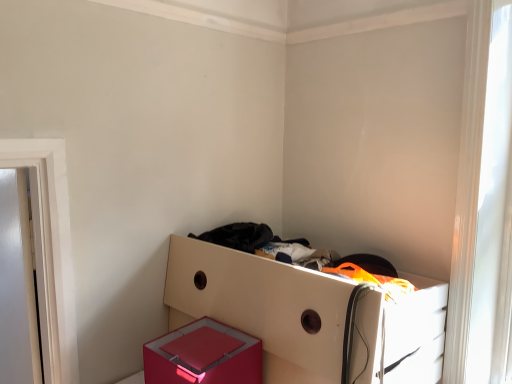
This screenshot has width=512, height=384. Describe the element at coordinates (262, 306) in the screenshot. I see `white glossy drawer at center` at that location.

The width and height of the screenshot is (512, 384). Describe the element at coordinates (203, 355) in the screenshot. I see `shiny pink box at lower center` at that location.

At what (x,y) coordinates should I click in order to perform the action: click on white glossy drawer at center. Please return your answer as a coordinate pair (x, y). Looking at the image, I should click on tap(262, 306).

Identify the location of furniture below the transparent glass window at upper right (from a real-world perspective). (262, 306).

Between transparent glass window at upper right and white glossy drawer at center, which one has more height?

transparent glass window at upper right.

Is transparent glass window at upper right not inside white glossy drawer at center?

Yes, transparent glass window at upper right is located beyond the bounds of white glossy drawer at center.

Is shiny pink box at lower center a part of white glossy drawer at center?

That's incorrect, shiny pink box at lower center is not inside white glossy drawer at center.

What's the angular difference between white glossy drawer at center and shiny pink box at lower center's facing directions?

There is a 0.0903-degree angle between the facing directions of white glossy drawer at center and shiny pink box at lower center.

From a real-world perspective, is white glossy drawer at center located beneath shiny pink box at lower center?

Yes, from a real-world perspective, white glossy drawer at center is under shiny pink box at lower center.

Is white glossy drawer at center not near shiny pink box at lower center?

No, there isn't a large distance between white glossy drawer at center and shiny pink box at lower center.

From the image's perspective, is transparent glass window at upper right above or below shiny pink box at lower center?

From the image's perspective, transparent glass window at upper right appears above shiny pink box at lower center.

The image size is (512, 384). What are the coordinates of `window on the right of shiny pink box at lower center` in the screenshot? It's located at (494, 217).

Is transparent glass window at upper right next to shiny pink box at lower center?

They are not placed beside each other.

Which object is positioned more to the left, white glossy drawer at center or transparent glass window at upper right?

white glossy drawer at center is more to the left.

I want to click on furniture below the transparent glass window at upper right (from a real-world perspective), so click(x=262, y=306).

Can you confirm if white glossy drawer at center is thinner than transparent glass window at upper right?

No.

Considering the points (433, 324) and (509, 299), which point is in front, point (433, 324) or point (509, 299)?

Positioned in front is point (433, 324).

From a real-world perspective, is shiny pink box at lower center under transparent glass window at upper right?

Yes, from a real-world perspective, shiny pink box at lower center is beneath transparent glass window at upper right.

Which point is more forward, (146, 348) or (475, 263)?

The point (146, 348) is closer.

Based on the photo, which object is closer to the camera, shiny pink box at lower center or transparent glass window at upper right?

shiny pink box at lower center is more forward.

Based on the photo, from the image's perspective, between shiny pink box at lower center and white glossy drawer at center, which one is located above?

From the image's view, white glossy drawer at center is above.

From a real-world perspective, is shiny pink box at lower center over white glossy drawer at center?

Indeed, from a real-world perspective, shiny pink box at lower center stands above white glossy drawer at center.

The height and width of the screenshot is (384, 512). What are the coordinates of `box behind the white glossy drawer at center` in the screenshot? It's located at [x=203, y=355].

Where is `window that appears on the right of white glossy drawer at center`? The height and width of the screenshot is (384, 512). window that appears on the right of white glossy drawer at center is located at coordinates (494, 217).

In the image, there is a white glossy drawer at center. At what (x,y) coordinates should I click in order to perform the action: click on box below it (from the image's perspective). Please return your answer as a coordinate pair (x, y). Looking at the image, I should click on (203, 355).

Considering their positions, is transparent glass window at upper right positioned closer to shiny pink box at lower center than white glossy drawer at center?

white glossy drawer at center.

Based on their spatial positions, is shiny pink box at lower center or transparent glass window at upper right further from white glossy drawer at center?

transparent glass window at upper right.

Based on their spatial positions, is shiny pink box at lower center or white glossy drawer at center further from transparent glass window at upper right?

shiny pink box at lower center.

When comparing their distances from transparent glass window at upper right, does white glossy drawer at center or shiny pink box at lower center seem closer?

Among the two, white glossy drawer at center is located nearer to transparent glass window at upper right.

Looking at the image, which one is located closer to shiny pink box at lower center, white glossy drawer at center or transparent glass window at upper right?

The object closer to shiny pink box at lower center is white glossy drawer at center.

Estimate the real-world distances between objects in this image. Which object is closer to white glossy drawer at center, transparent glass window at upper right or shiny pink box at lower center?

Among the two, shiny pink box at lower center is located nearer to white glossy drawer at center.

Find the location of a particular element. This screenshot has width=512, height=384. furniture between shiny pink box at lower center and transparent glass window at upper right from left to right is located at coordinates (262, 306).